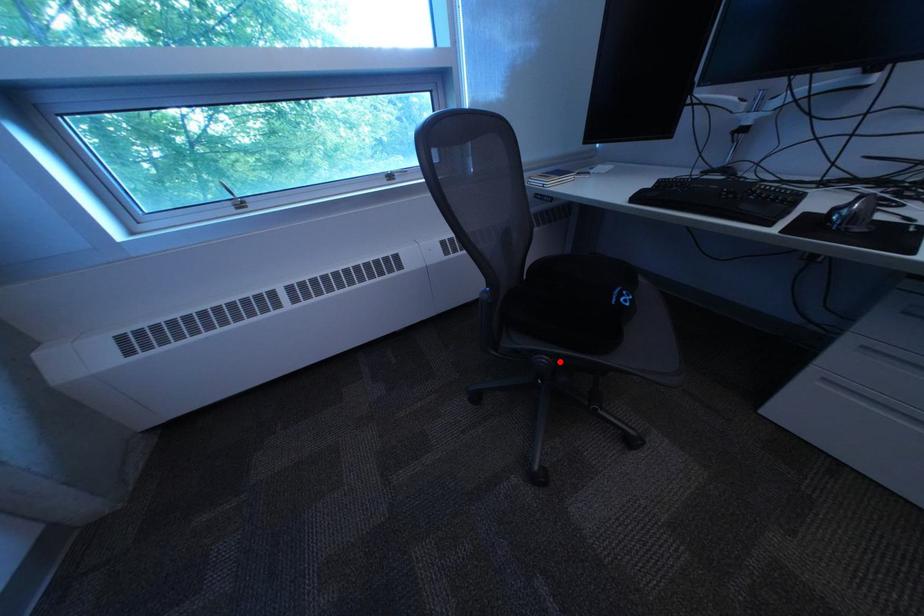
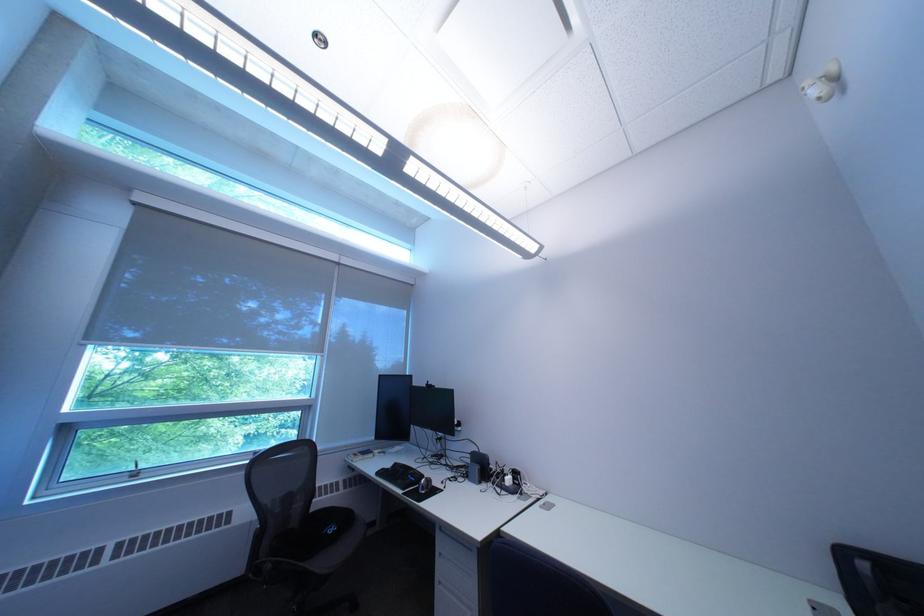
Find the pixel in the second image that matches the highlighted location in the first image.

(285, 568)